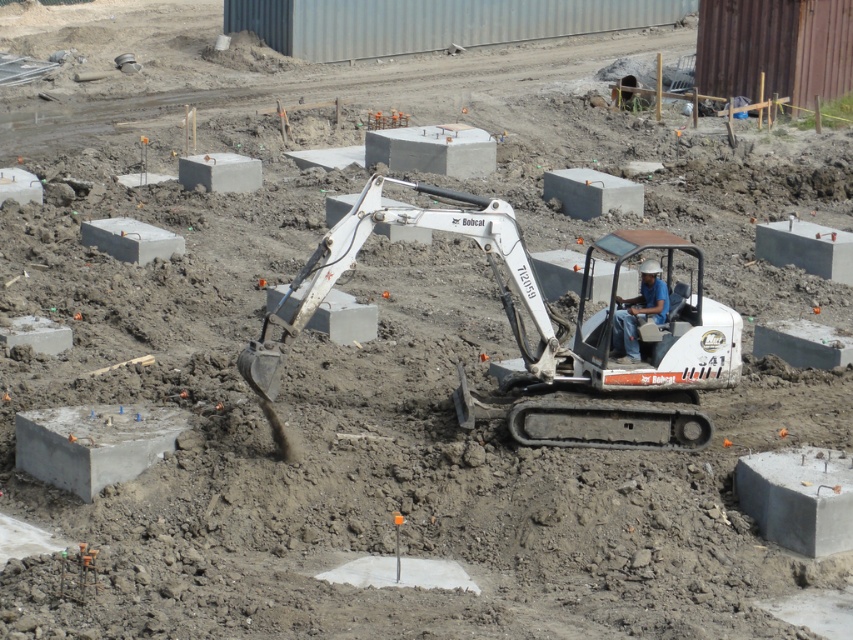
Question: Among these points, which one is farthest from the camera?

Choices:
 (A) (689, 292)
 (B) (840, 500)
 (C) (618, 340)

Answer: (C)

Question: Does white metallic excavator at center appear under blue fabric construction worker at center?

Choices:
 (A) yes
 (B) no

Answer: (A)

Question: Can you confirm if white metallic excavator at center is thinner than blue fabric construction worker at center?

Choices:
 (A) yes
 (B) no

Answer: (A)

Question: Among these objects, which one is farthest from the camera?

Choices:
 (A) gray concrete block at lower right
 (B) white metallic excavator at center
 (C) blue fabric construction worker at center
 (D) gray concrete block at lower left

Answer: (B)

Question: Does gray concrete block at lower right appear on the left side of blue fabric construction worker at center?

Choices:
 (A) no
 (B) yes

Answer: (A)

Question: Estimate the real-world distances between objects in this image. Which object is closer to the white metallic excavator at center?

Choices:
 (A) gray concrete block at lower right
 (B) gray concrete block at lower left

Answer: (A)